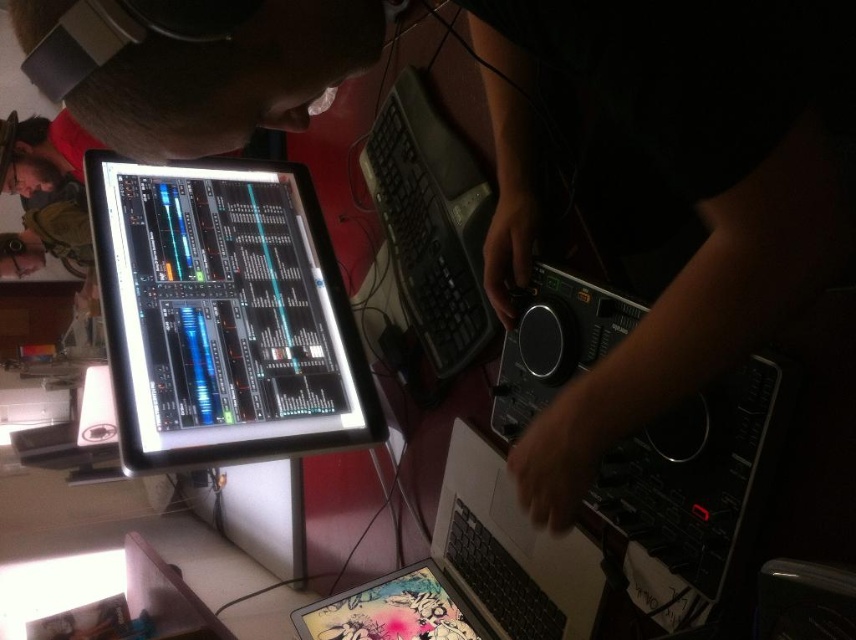
You are a photographer standing at the point marked as point (122,316). You want to take a photo of the DJ setup. The camera you are using has a focal length of 50mm and requires a minimum distance of 1.2 meters to avoid blurring. Will you be able to take a clear photo from your current position?

The distance between point (122,316) and the camera is 1.16 meters. Since the required minimum distance is 1.2 meters, you are slightly too close to take a clear photo without blurring.

You are a music producer who needs to locate your metallic silver laptop at lower center. According to the coordinates provided, where exactly is it positioned in the image?

The metallic silver laptop at lower center is located at point coordinates of (473, 570).

You are setting up a music production studio and need to place the matte black monitor at upper left and the black plastic keyboard at center on a desk. Given that the desk has limited space, which object should you prioritize placing first to ensure it fits properly?

The matte black monitor at upper left should be prioritized since it has a larger size compared to the black plastic keyboard at center, ensuring it has enough space on the desk.